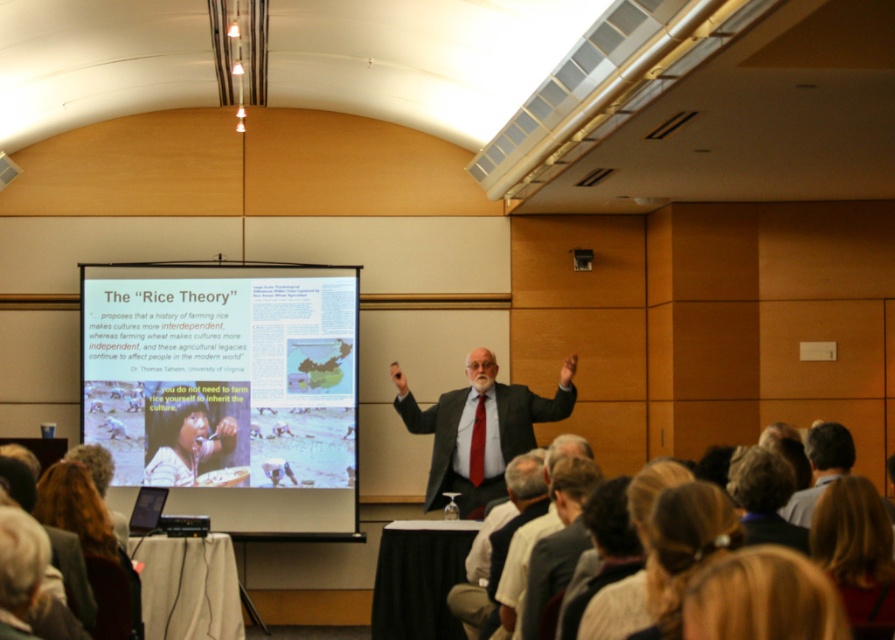
Question: Is blonde hair at upper right below dark brown hair at upper center?

Choices:
 (A) yes
 (B) no

Answer: (A)

Question: Among these objects, which one is farthest from the camera?

Choices:
 (A) dark brown hair at upper center
 (B) white matte projection screen at center
 (C) blonde hair at lower right

Answer: (B)

Question: Does dark gray suit at center appear over dark brown hair at upper center?

Choices:
 (A) yes
 (B) no

Answer: (B)

Question: Based on their relative distances, which object is farther from the blonde hair at upper right?

Choices:
 (A) dark brown hair at upper center
 (B) white matte projection screen at center
 (C) dark gray suit at center
 (D) blonde hair at lower right

Answer: (B)

Question: Which point is closer to the camera?

Choices:
 (A) dark gray suit at center
 (B) dark brown hair at upper center
 (C) white matte projection screen at center
 (D) blonde hair at lower right

Answer: (B)

Question: Does blonde hair at upper right lie behind blonde hair at lower right?

Choices:
 (A) yes
 (B) no

Answer: (B)